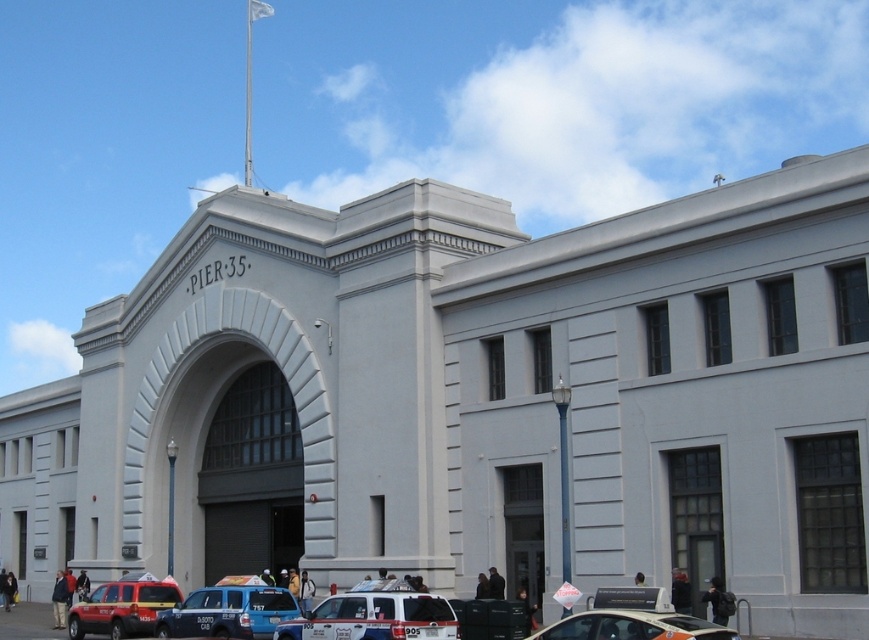
Question: Is blue metallic van at lower center closer to camera compared to matte red suv at lower left?

Choices:
 (A) no
 (B) yes

Answer: (B)

Question: Which object is farther from the camera taking this photo?

Choices:
 (A) white glossy van at lower center
 (B) white glossy car at lower right
 (C) matte red suv at lower left
 (D) blue metallic van at lower center

Answer: (C)

Question: Which point is farther to the camera?

Choices:
 (A) blue metallic van at lower center
 (B) white glossy car at lower right

Answer: (A)

Question: Based on their relative distances, which object is farther from the white glossy van at lower center?

Choices:
 (A) blue metallic van at lower center
 (B) matte red suv at lower left

Answer: (B)

Question: Is white glossy van at lower center wider than white glossy car at lower right?

Choices:
 (A) no
 (B) yes

Answer: (B)

Question: Can you confirm if white glossy car at lower right is positioned above matte red suv at lower left?

Choices:
 (A) no
 (B) yes

Answer: (B)